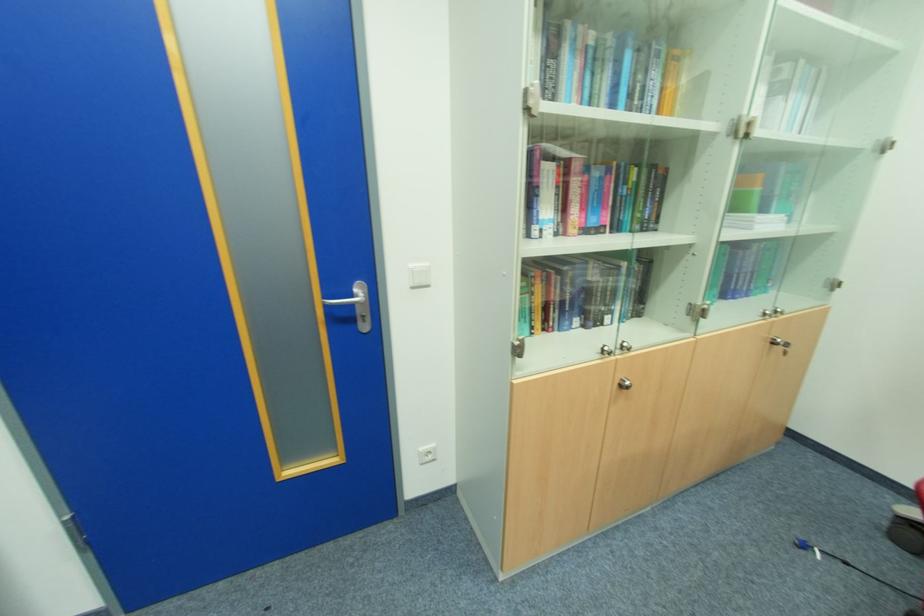
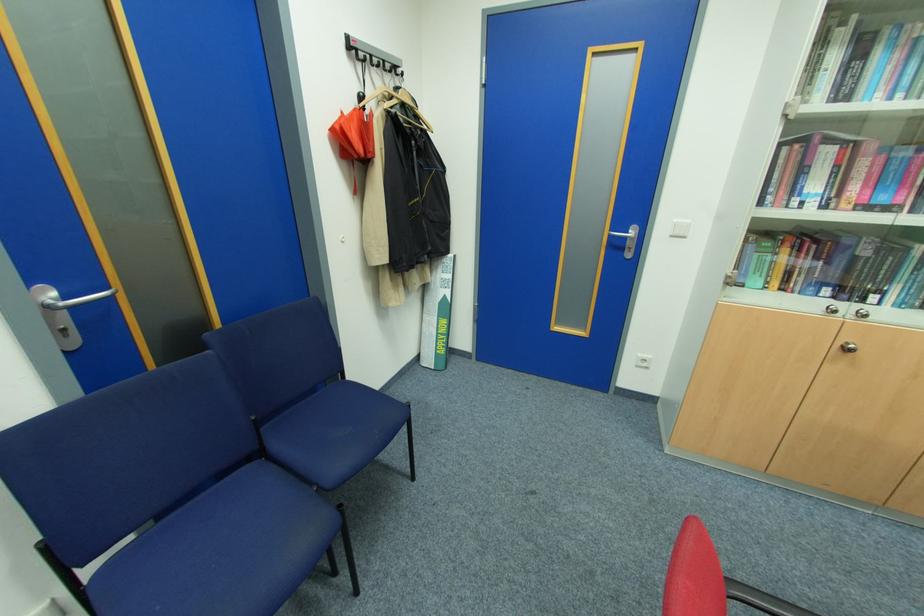
Find the pixel in the second image that matches point 622,351 in the first image.

(855, 315)